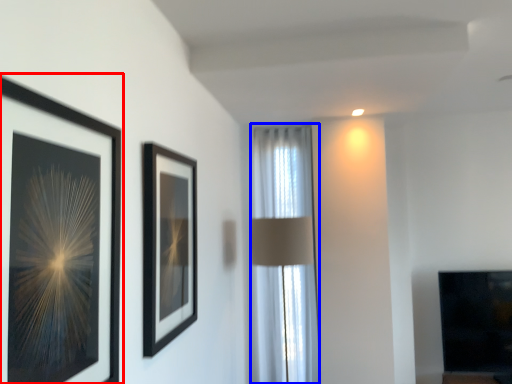
Question: Among these objects, which one is nearest to the camera, picture frame (highlighted by a red box) or curtain (highlighted by a blue box)?

Choices:
 (A) picture frame
 (B) curtain

Answer: (A)